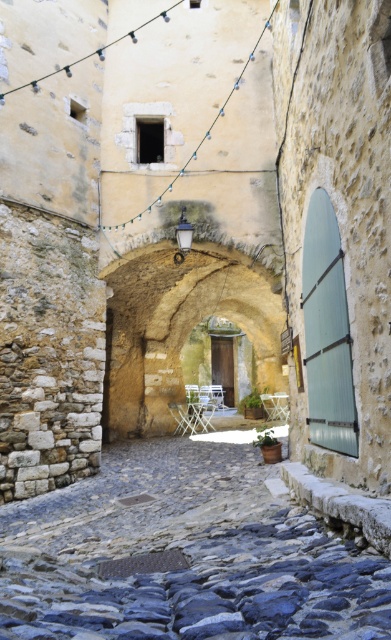
Question: Which of the following is the closest to the observer?

Choices:
 (A) (211, 3)
 (B) (172, 461)
 (C) (240, 291)
 (D) (276, 410)

Answer: (B)

Question: Which object is the closest to the smooth stone window at upper center?

Choices:
 (A) white plastic chair at center
 (B) stone textured archway at center
 (C) smooth cobblestone alley at center

Answer: (B)

Question: Which is nearer to the stone textured archway at center?

Choices:
 (A) smooth stone window at upper center
 (B) white plastic chair at center
 (C) smooth cobblestone alley at center

Answer: (A)

Question: Does smooth stone window at upper center lie in front of stone textured archway at center?

Choices:
 (A) yes
 (B) no

Answer: (A)

Question: Where is stone textured archway at center located in relation to white plastic chair at center in the image?

Choices:
 (A) right
 (B) left

Answer: (B)

Question: Is smooth stone window at upper center wider than white plastic chair at center?

Choices:
 (A) no
 (B) yes

Answer: (B)